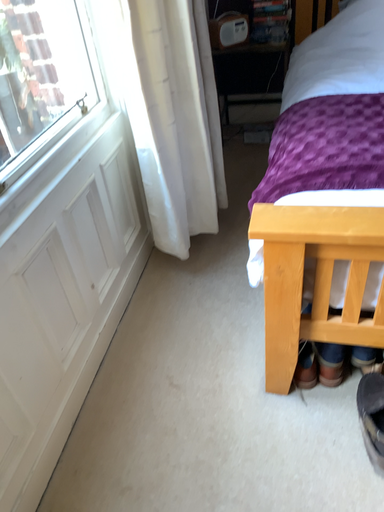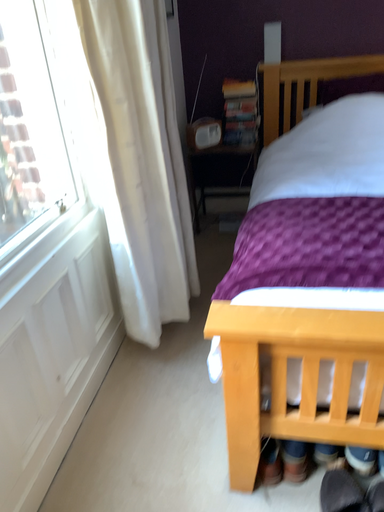
Question: Which way did the camera rotate in the video?

Choices:
 (A) rotated upward
 (B) rotated downward

Answer: (A)